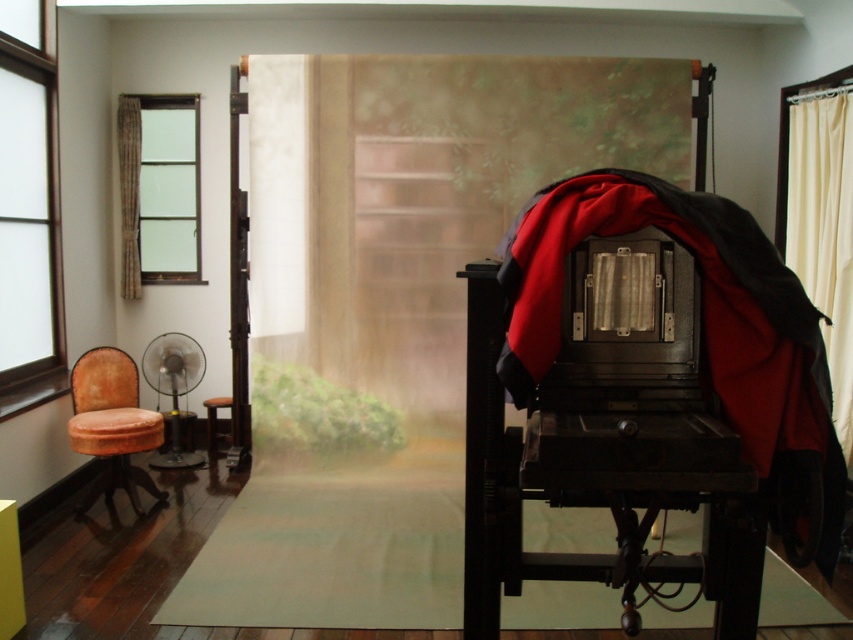
You are setting up a photography session in this studio and need to decide where to place a wide reflective surface. The satin glass window at left and the brown wooden window at upper left are both options. Which window has a smaller width and thus might be better suited for a smaller reflective surface?

The satin glass window at left has a lesser width compared to the brown wooden window at upper left, making it better suited for a smaller reflective surface.

You are setting up a photo shoot in this studio and need to position a model between the satin glass window at left and the metallic silver fan at center. Based on their positions, which object should the model be closer to?

The model should be closer to the satin glass window at left because it is in front of the metallic silver fan at center, meaning the window is nearer to the model.